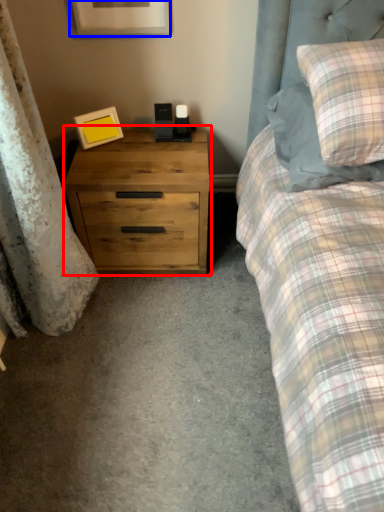
Question: Among these objects, which one is nearest to the camera, chest of drawers (highlighted by a red box) or picture frame (highlighted by a blue box)?

Choices:
 (A) chest of drawers
 (B) picture frame

Answer: (B)